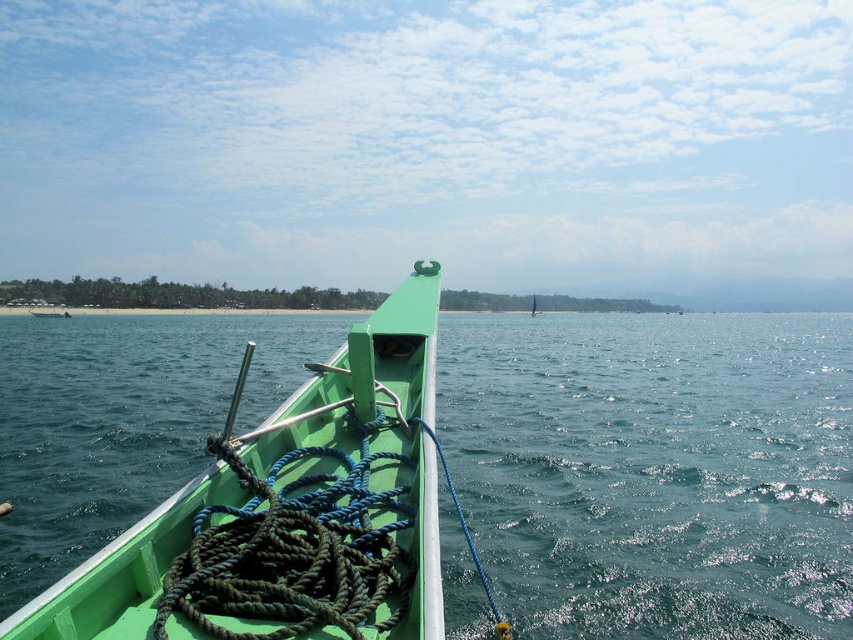
Question: Which of the following is the closest to the observer?

Choices:
 (A) blue braided rope at center
 (B) dark green rope at center
 (C) green matte boat at center

Answer: (B)

Question: Which point appears farthest from the camera in this image?

Choices:
 (A) (318, 609)
 (B) (4, 632)

Answer: (A)

Question: Which object appears farthest from the camera in this image?

Choices:
 (A) blue braided rope at center
 (B) dark green rope at center

Answer: (A)

Question: Is green matte boat at center bigger than dark green rope at center?

Choices:
 (A) yes
 (B) no

Answer: (B)

Question: Is green matte boat at center bigger than dark green rope at center?

Choices:
 (A) yes
 (B) no

Answer: (B)

Question: Does dark green rope at center lie in front of blue braided rope at center?

Choices:
 (A) yes
 (B) no

Answer: (A)